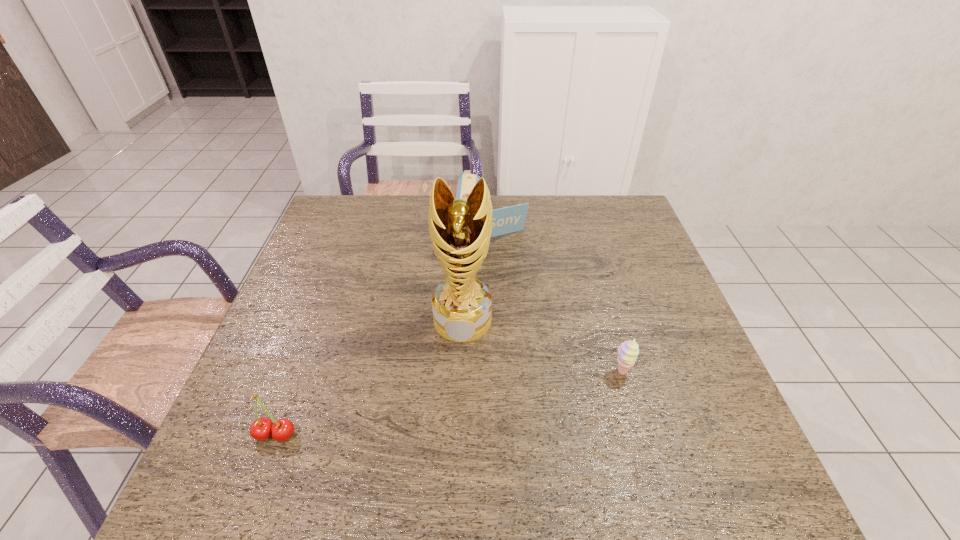
This screenshot has height=540, width=960. What are the coordinates of `free spot between the leftmost object and the second nearest object` in the screenshot? It's located at (448, 403).

You are a GUI agent. You are given a task and a screenshot of the screen. Output one action in this format:
    pyautogui.click(x=<x>, y=<y>)
    Task: Click on the free space between the camcorder and the sherbert
    This screenshot has width=960, height=540.
    Given the screenshot: What is the action you would take?
    pyautogui.click(x=557, y=302)

Locate an element on the screen. free space that is in between the second tallest object and the tallest object is located at coordinates (477, 276).

You are a GUI agent. You are given a task and a screenshot of the screen. Output one action in this format:
    pyautogui.click(x=<x>, y=<y>)
    Task: Click on the vacant area that lies between the sherbert and the award
    
    Given the screenshot: What is the action you would take?
    pyautogui.click(x=542, y=346)

You are a GUI agent. You are given a task and a screenshot of the screen. Output one action in this format:
    pyautogui.click(x=<x>, y=<y>)
    Task: Click on the free area in between the farthest object and the tallest object
    The image size is (960, 540).
    Given the screenshot: What is the action you would take?
    pyautogui.click(x=477, y=276)

Identify which object is the third nearest to the cherry. Please provide its 2D coordinates. Your answer should be formatted as a tuple, i.e. [(x, y)], where the tuple contains the x and y coordinates of a point satisfying the conditions above.

[(627, 352)]

Where is `object that is the third closest to the nearest object`? Image resolution: width=960 pixels, height=540 pixels. object that is the third closest to the nearest object is located at coordinates (627, 352).